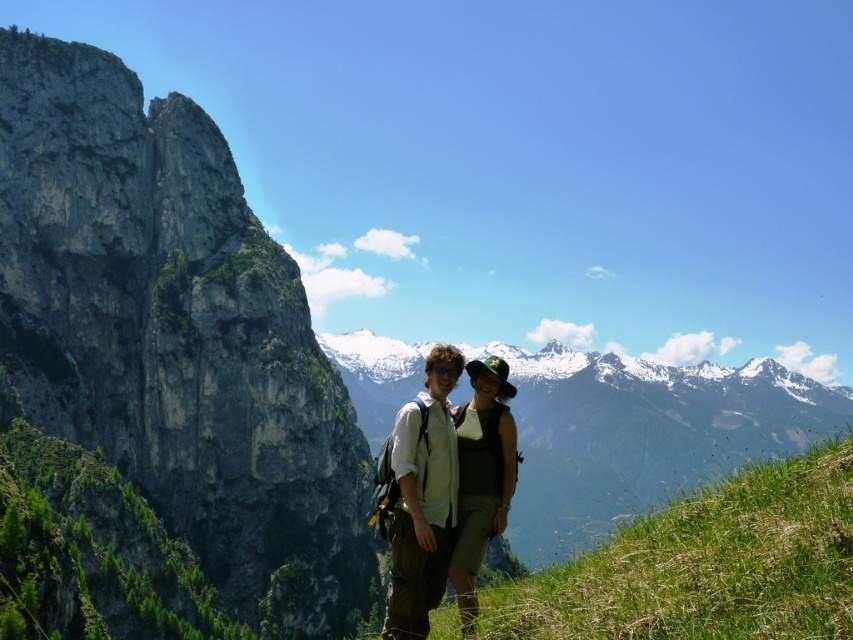
You are a photographer planning to take a portrait of the two people in the scene. You want to ensure that both the matte white shirt at center and the green fabric hat at center are clearly visible in the photo. Based on their positions, which object should you focus on first to ensure both are in sharp focus?

The matte white shirt at center is positioned under the green fabric hat at center. To ensure both are in sharp focus, you should focus on the matte white shirt at center first since it is closer to the camera, and the green fabric hat at center will naturally fall into focus as it is behind the shirt.

Based on the scene description, where is the green grassy hillside at left located in terms of its 2D coordinates?

The green grassy hillside at left is located at the 2D coordinates point [158,378].